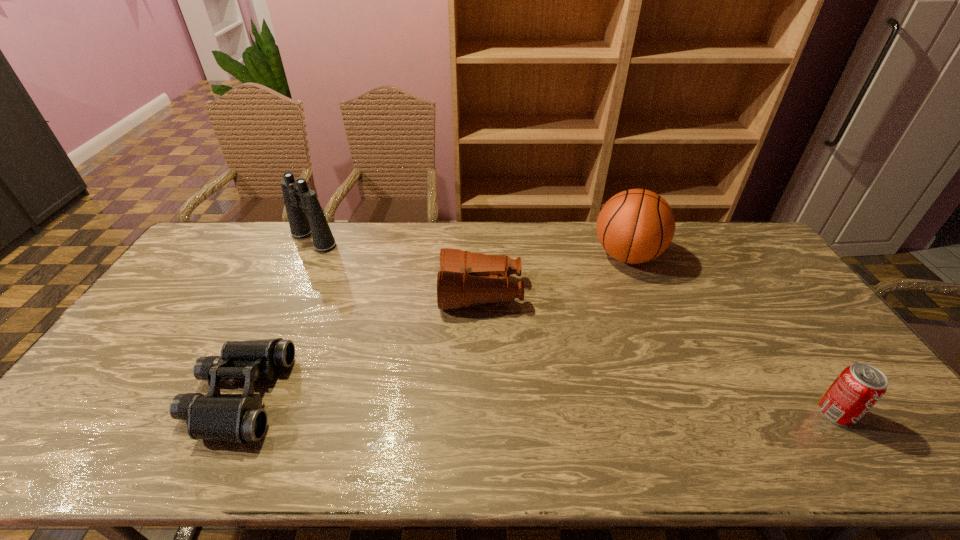
The height and width of the screenshot is (540, 960). What are the coordinates of `vacant area at the right edge` in the screenshot? It's located at (811, 321).

Locate an element on the screen. This screenshot has width=960, height=540. vacant space at the far right corner of the desktop is located at coordinates (702, 224).

The image size is (960, 540). What are the coordinates of `free space between the soda can and the third object from left to right` in the screenshot? It's located at (659, 353).

Where is `free point between the tallest binoculars and the rightmost object`? The height and width of the screenshot is (540, 960). free point between the tallest binoculars and the rightmost object is located at coordinates (575, 326).

Find the location of a particular element. The width and height of the screenshot is (960, 540). free point between the farthest binoculars and the third tallest object is located at coordinates (575, 326).

Where is `vacant space that's between the rightmost binoculars and the nearest binoculars`? This screenshot has height=540, width=960. vacant space that's between the rightmost binoculars and the nearest binoculars is located at coordinates (359, 344).

Where is `vacant region between the tallest binoculars and the third shortest object`? vacant region between the tallest binoculars and the third shortest object is located at coordinates (575, 326).

Where is `free spot between the farthest binoculars and the rightmost object`? free spot between the farthest binoculars and the rightmost object is located at coordinates (575, 326).

Where is `unoccupied area between the soda can and the second object from right to left`? The width and height of the screenshot is (960, 540). unoccupied area between the soda can and the second object from right to left is located at coordinates (732, 334).

Locate an element on the screen. The height and width of the screenshot is (540, 960). free space between the soda can and the farthest binoculars is located at coordinates (575, 326).